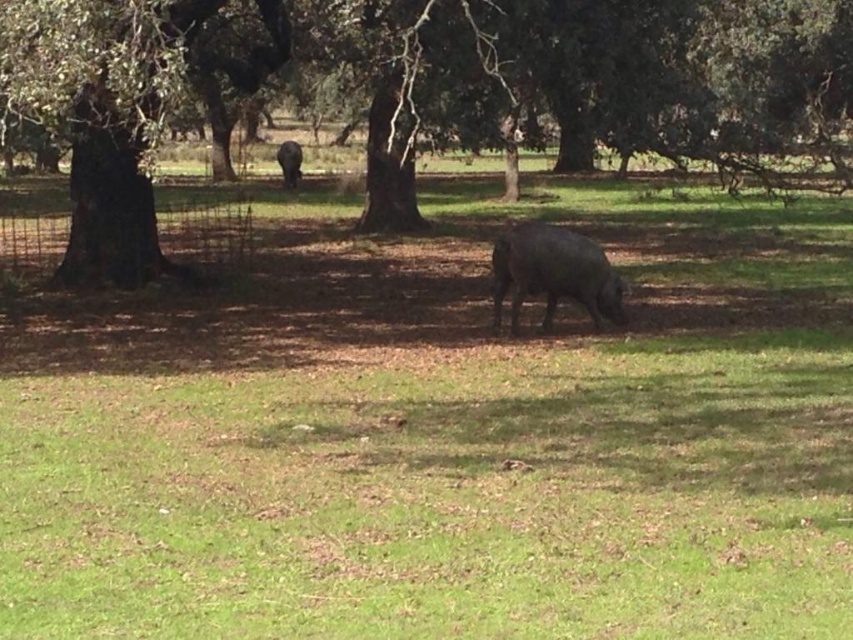
You are a hiker trying to locate the dark brown bark at left and the dark gray matte pig at center in the image. According to the scene description, which object is positioned to the right of the other?

The dark brown bark at left is positioned to the right of the dark gray matte pig at center.